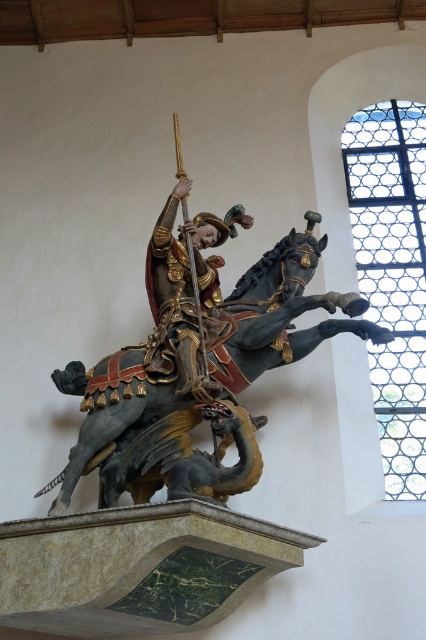
Question: Which point is closer to the camera?

Choices:
 (A) gold polished armor at center
 (B) polished dark gray horse at center

Answer: (B)

Question: Is polished dark gray horse at center above gold polished armor at center?

Choices:
 (A) no
 (B) yes

Answer: (A)

Question: Where is polished dark gray horse at center located in relation to gold polished armor at center in the image?

Choices:
 (A) left
 (B) right

Answer: (B)

Question: Is polished dark gray horse at center smaller than gold polished armor at center?

Choices:
 (A) no
 (B) yes

Answer: (A)

Question: Among these objects, which one is nearest to the camera?

Choices:
 (A) polished dark gray horse at center
 (B) gold polished armor at center

Answer: (A)